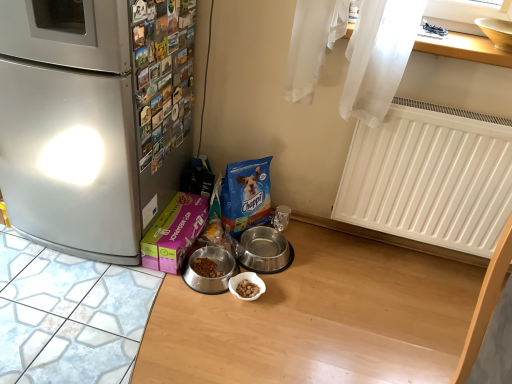
Identify the location of free space above pink matte box at lower left (from a real-world perspective). (183, 218).